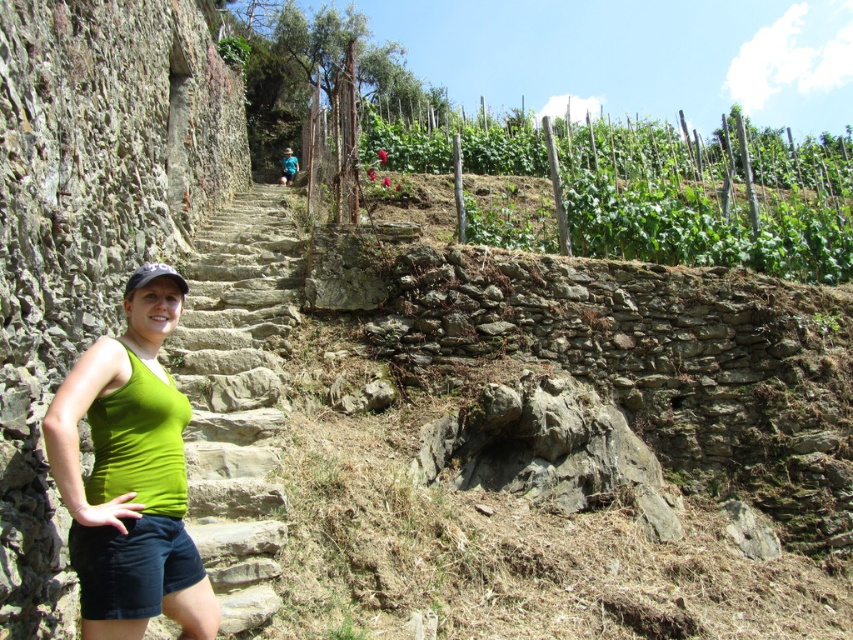
Find the location of `stone stairs at center`. stone stairs at center is located at coordinates (236, 394).

Between point (239, 250) and point (102, 497), which one is positioned behind?

The point (239, 250) is more distant.

Locate an element on the screen. stone stairs at center is located at coordinates (236, 394).

The image size is (853, 640). I want to click on stone stairs at center, so click(236, 394).

Is point (196, 317) less distant than point (109, 582)?

No, it is not.

Find the location of a particular element. stone stairs at center is located at coordinates (236, 394).

Measure the distance between green fabric tank top at center and camera.

They are 15.96 meters apart.

Who is more forward, (163, 323) or (125, 563)?

Point (125, 563)

Image resolution: width=853 pixels, height=640 pixels. What are the coordinates of `green fabric tank top at center` in the screenshot? It's located at (131, 474).